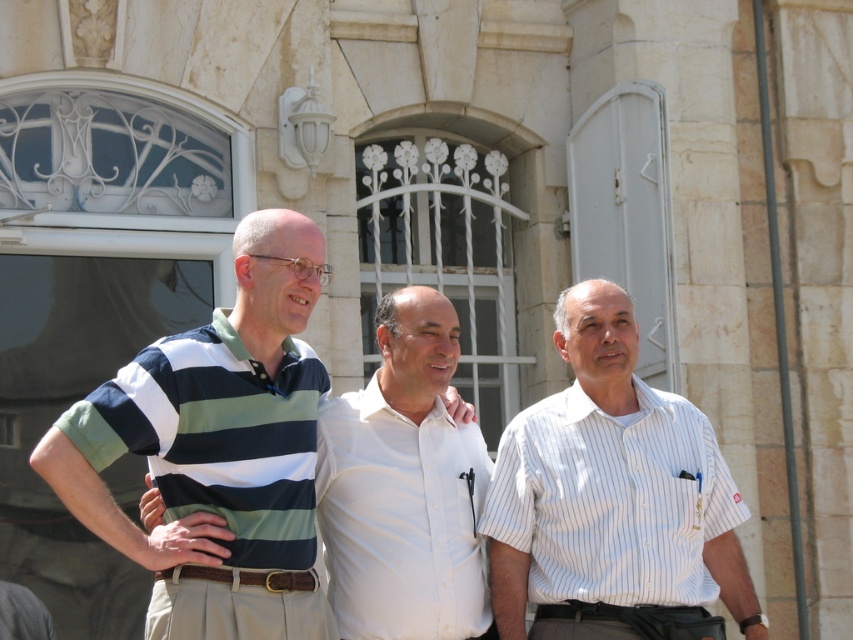
Which is below, white striped shirt at center or striped cotton polo shirt at center?

Positioned lower is white striped shirt at center.

Between point (670, 513) and point (193, 492), which one is positioned behind?

Point (670, 513)

Who is more distant from viewer, (570, 317) or (86, 522)?

The point (570, 317) is more distant.

Locate an element on the screen. This screenshot has height=640, width=853. white striped shirt at center is located at coordinates (612, 499).